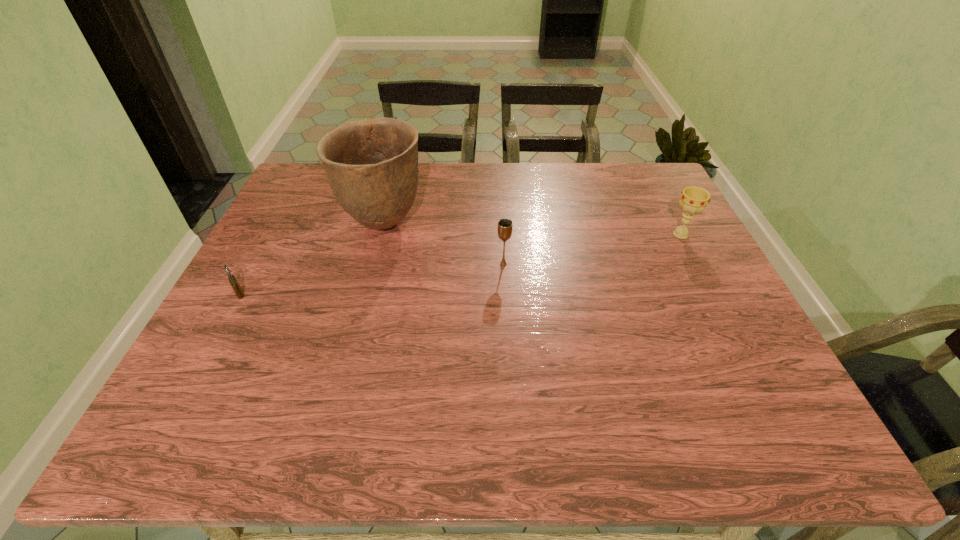
This screenshot has height=540, width=960. I want to click on the third object from right to left, so click(372, 165).

This screenshot has height=540, width=960. Find the location of `the tallest object`. the tallest object is located at coordinates (372, 165).

Image resolution: width=960 pixels, height=540 pixels. I want to click on the farther chalice, so click(694, 199).

Find the location of a particular element. Image resolution: width=960 pixels, height=540 pixels. the right chalice is located at coordinates (694, 199).

Locate an element on the screen. Image resolution: width=960 pixels, height=540 pixels. the second object from right to left is located at coordinates (505, 225).

The width and height of the screenshot is (960, 540). I want to click on the left chalice, so click(x=505, y=225).

Locate an element on the screen. the nearest object is located at coordinates (233, 281).

This screenshot has width=960, height=540. Identify the location of the shortest object. (233, 281).

I want to click on vacant space situated on the left of the second object from left to right, so coord(294,224).

Locate an element on the screen. This screenshot has width=960, height=540. vacant space located on the front of the rightmost object is located at coordinates (735, 340).